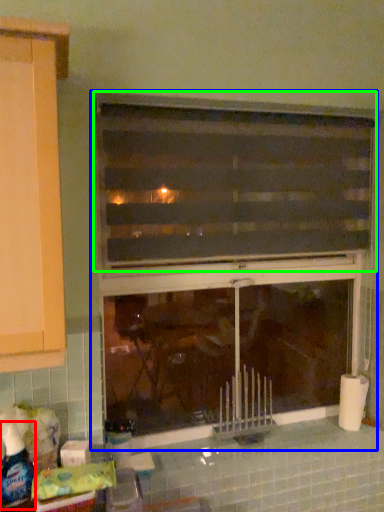
Question: Estimate the real-world distances between objects in this image. Which object is farther from bottle (highlighted by a red box), window (highlighted by a blue box) or window (highlighted by a green box)?

Choices:
 (A) window
 (B) window

Answer: (B)